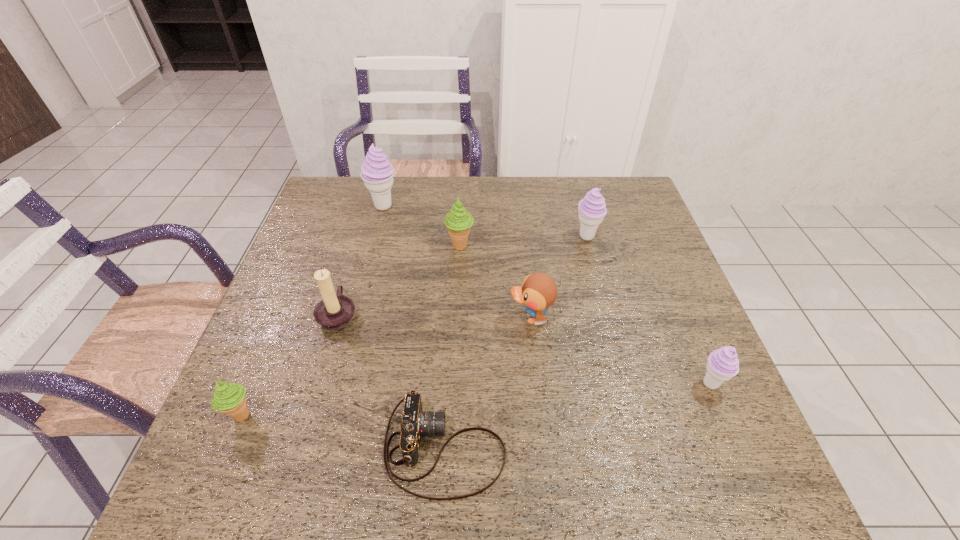
Locate an element on the screen. This screenshot has height=540, width=960. vacant point located between the brown camera and the second smallest purple icecream is located at coordinates (516, 342).

Find the location of a particular element. The height and width of the screenshot is (540, 960). free spot between the second farthest purple icecream and the farther green icecream is located at coordinates (523, 241).

I want to click on unoccupied area between the candle holder and the nearer green icecream, so click(x=290, y=364).

I want to click on object that can be found as the fifth closest to the duck, so click(335, 311).

The image size is (960, 540). I want to click on object that can be found as the closest to the leftmost purple icecream, so click(x=458, y=221).

Select which icecream appears as the fourth closest to the tallest object. Please provide its 2D coordinates. Your answer should be formatted as a tuple, i.e. [(x, y)], where the tuple contains the x and y coordinates of a point satisfying the conditions above.

[(723, 364)]

The image size is (960, 540). In order to click on the second closest icecream to the brown candle holder in this screenshot , I will do `click(458, 221)`.

The width and height of the screenshot is (960, 540). I want to click on purple icecream identified as the second closest to the blue duck, so click(723, 364).

Find the location of a particular element. The image size is (960, 540). the closest purple icecream relative to the second nearest icecream is located at coordinates (592, 209).

Where is `vacant region that satisfies the following two spatial constraints: 1. on the front side of the second nearest icecream; 2. on the front-facing side of the camera`? The width and height of the screenshot is (960, 540). vacant region that satisfies the following two spatial constraints: 1. on the front side of the second nearest icecream; 2. on the front-facing side of the camera is located at coordinates tap(737, 448).